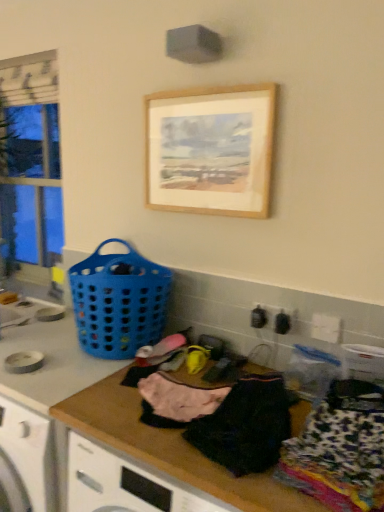
Question: Is clear glass window at left turned away from blue plastic basket at left?

Choices:
 (A) no
 (B) yes

Answer: (A)

Question: Is clear glass window at left shorter than blue plastic basket at left?

Choices:
 (A) yes
 (B) no

Answer: (B)

Question: Is clear glass window at left at the right side of blue plastic basket at left?

Choices:
 (A) yes
 (B) no

Answer: (B)

Question: Can you confirm if clear glass window at left is taller than blue plastic basket at left?

Choices:
 (A) yes
 (B) no

Answer: (A)

Question: Is clear glass window at left touching blue plastic basket at left?

Choices:
 (A) no
 (B) yes

Answer: (A)

Question: Considering the positions of blue plastic basket at left and printed fabric clothing at lower right, marked as the 1th clothing in a right-to-left arrangement, in the image, is blue plastic basket at left bigger or smaller than printed fabric clothing at lower right, marked as the 1th clothing in a right-to-left arrangement,?

Choices:
 (A) big
 (B) small

Answer: (A)

Question: Considering the positions of blue plastic basket at left and printed fabric clothing at lower right, marked as the 1th clothing in a right-to-left arrangement, in the image, is blue plastic basket at left wider or thinner than printed fabric clothing at lower right, marked as the 1th clothing in a right-to-left arrangement,?

Choices:
 (A) wide
 (B) thin

Answer: (B)

Question: Would you say blue plastic basket at left is inside or outside printed fabric clothing at lower right, marked as the 1th clothing in a right-to-left arrangement?

Choices:
 (A) inside
 (B) outside

Answer: (B)

Question: From the image's perspective, is blue plastic basket at left above or below printed fabric clothing at lower right, marked as the 3th clothing in a left-to-right arrangement?

Choices:
 (A) above
 (B) below

Answer: (A)

Question: Considering the relative positions of printed fabric clothing at lower right, marked as the 1th clothing in a right-to-left arrangement, and wooden at center in the image provided, is printed fabric clothing at lower right, marked as the 1th clothing in a right-to-left arrangement, to the left or to the right of wooden at center?

Choices:
 (A) right
 (B) left

Answer: (A)

Question: Considering their positions, is printed fabric clothing at lower right, marked as the 1th clothing in a right-to-left arrangement, located in front of or behind wooden at center?

Choices:
 (A) behind
 (B) front

Answer: (B)

Question: Is printed fabric clothing at lower right, marked as the 1th clothing in a right-to-left arrangement, situated inside wooden at center or outside?

Choices:
 (A) inside
 (B) outside

Answer: (B)

Question: From a real-world perspective, is printed fabric clothing at lower right, marked as the 3th clothing in a left-to-right arrangement, positioned above or below wooden at center?

Choices:
 (A) below
 (B) above

Answer: (B)

Question: Is point (87, 406) positioned closer to the camera than point (236, 124)?

Choices:
 (A) closer
 (B) farther

Answer: (A)

Question: Is wooden at center in front of or behind wooden picture frame at upper center in the image?

Choices:
 (A) behind
 (B) front

Answer: (B)